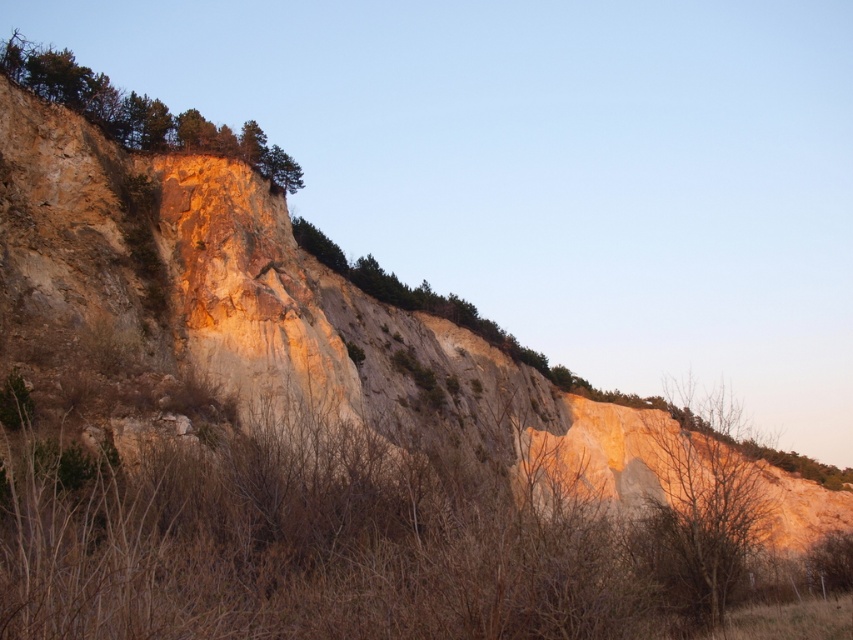
In the scene shown: You are standing at the origin point of the coordinate system. Looking at the cliff scene, where is the brown textured tree at center located in terms of coordinates?

The brown textured tree at center is located at coordinates point (704, 502).

You are a hiker standing at the base of the cliff and want to reach the top. You see a brown textured tree at center and a green rough rock at upper left. Which object is closer to the top of the cliff?

The green rough rock at upper left is closer to the top of the cliff because it is taller than the brown textured tree at center.